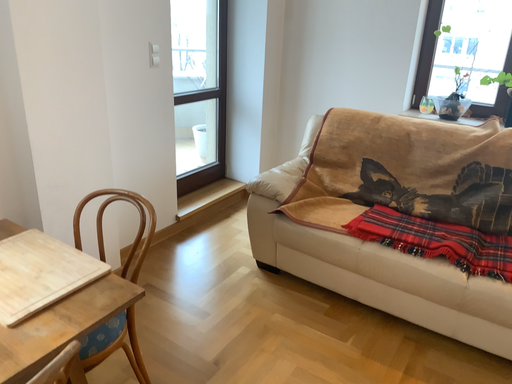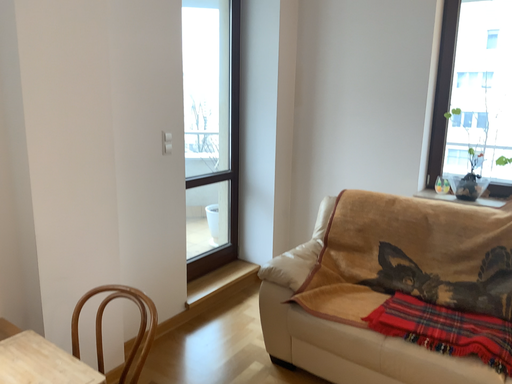
Question: How did the camera likely rotate when shooting the video?

Choices:
 (A) rotated downward
 (B) rotated upward

Answer: (B)